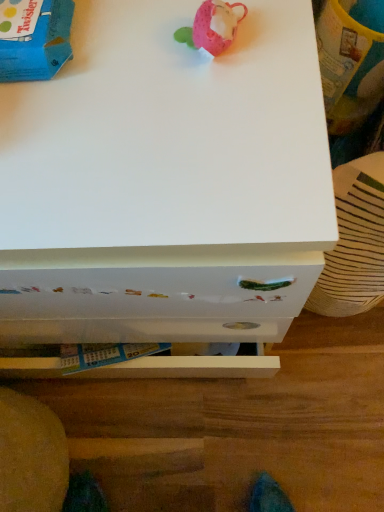
Question: From a real-world perspective, is white glossy drawer at lower center located higher than white painted wood chest of drawers at center?

Choices:
 (A) no
 (B) yes

Answer: (A)

Question: Is white glossy drawer at lower center to the right of white painted wood chest of drawers at center from the viewer's perspective?

Choices:
 (A) no
 (B) yes

Answer: (B)

Question: Does white glossy drawer at lower center have a lesser height compared to white painted wood chest of drawers at center?

Choices:
 (A) yes
 (B) no

Answer: (A)

Question: Is white painted wood chest of drawers at center inside white glossy drawer at lower center?

Choices:
 (A) yes
 (B) no

Answer: (B)

Question: Is white glossy drawer at lower center not close to white painted wood chest of drawers at center?

Choices:
 (A) no
 (B) yes

Answer: (A)

Question: Is pink fabric mouse at upper center, which is counted as the 1th toy, starting from the right, in front of or behind blue cardboard box at upper left, which is counted as the first toy, starting from the left, in the image?

Choices:
 (A) front
 (B) behind

Answer: (A)

Question: Is pink fabric mouse at upper center, which is counted as the 1th toy, starting from the right, spatially inside blue cardboard box at upper left, the 2th toy when ordered from right to left, or outside of it?

Choices:
 (A) inside
 (B) outside

Answer: (B)

Question: Does point (236, 18) appear closer or farther from the camera than point (54, 29)?

Choices:
 (A) farther
 (B) closer

Answer: (B)

Question: From a real-world perspective, is pink fabric mouse at upper center, which is counted as the 1th toy, starting from the right, positioned above or below blue cardboard box at upper left, the 2th toy when ordered from right to left?

Choices:
 (A) above
 (B) below

Answer: (A)

Question: In terms of size, does white glossy drawer at lower center appear bigger or smaller than pink fabric mouse at upper center, which is counted as the 1th toy, starting from the right?

Choices:
 (A) big
 (B) small

Answer: (A)

Question: Would you say white glossy drawer at lower center is to the left or to the right of pink fabric mouse at upper center, which is counted as the 1th toy, starting from the right, in the picture?

Choices:
 (A) left
 (B) right

Answer: (A)

Question: Is white glossy drawer at lower center wider or thinner than pink fabric mouse at upper center, which is counted as the 1th toy, starting from the right?

Choices:
 (A) wide
 (B) thin

Answer: (A)

Question: Which is correct: white glossy drawer at lower center is inside pink fabric mouse at upper center, the 2th toy from the left, or outside of it?

Choices:
 (A) inside
 (B) outside

Answer: (B)

Question: From the image's perspective, is blue cardboard box at upper left, which is counted as the first toy, starting from the left, above or below white glossy drawer at lower center?

Choices:
 (A) above
 (B) below

Answer: (A)

Question: From a real-world perspective, is blue cardboard box at upper left, the 2th toy when ordered from right to left, above or below white glossy drawer at lower center?

Choices:
 (A) above
 (B) below

Answer: (A)